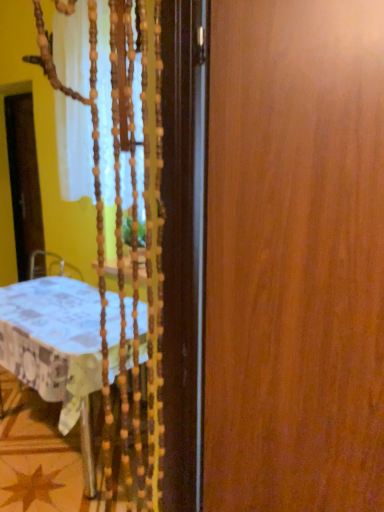
Question: Considering the positions of wooden door at right and transparent plastic screen door at left in the image, is wooden door at right bigger or smaller than transparent plastic screen door at left?

Choices:
 (A) small
 (B) big

Answer: (B)

Question: Is wooden door at right in front of or behind transparent plastic screen door at left in the image?

Choices:
 (A) front
 (B) behind

Answer: (A)

Question: Which of these objects is positioned closest to the white fabric tablecloth at left?

Choices:
 (A) transparent plastic screen door at left
 (B) wooden door at right

Answer: (B)

Question: Considering the real-world distances, which object is farthest from the white fabric tablecloth at left?

Choices:
 (A) wooden door at right
 (B) transparent plastic screen door at left

Answer: (B)